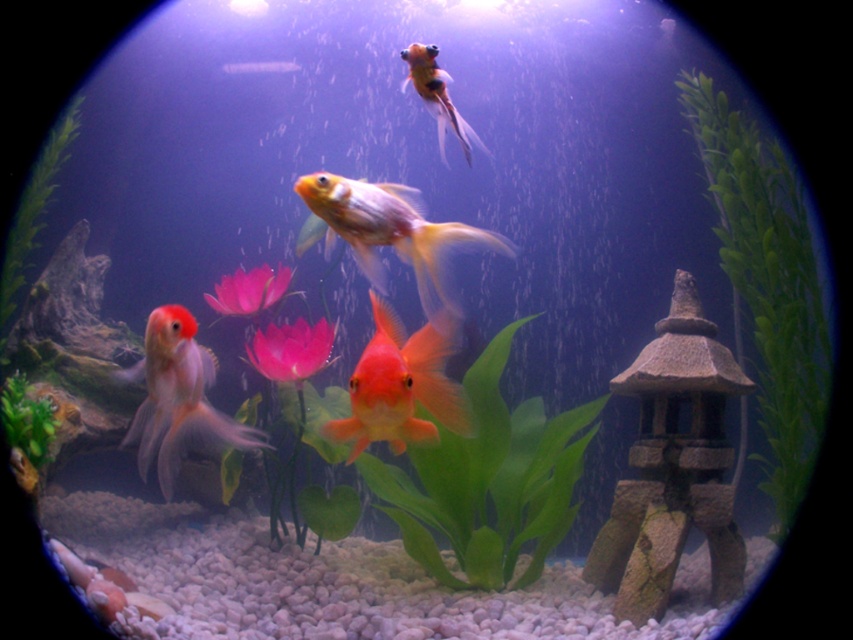
Question: Observing the image, what is the correct spatial positioning of pink matte flower at center in reference to green matte plant at lower left?

Choices:
 (A) below
 (B) above

Answer: (B)

Question: Does matte white goldfish at lower left appear under green matte plant at lower left?

Choices:
 (A) yes
 (B) no

Answer: (B)

Question: Which point appears farthest from the camera in this image?

Choices:
 (A) (270, 300)
 (B) (463, 390)
 (C) (19, 253)

Answer: (C)

Question: Which point is farther to the camera?

Choices:
 (A) green matte plant at lower left
 (B) green leafy plant at center
 (C) green leafy plant at left
 (D) shiny orange fish at upper center

Answer: (C)

Question: Among these objects, which one is farthest from the camera?

Choices:
 (A) pink matte flower at center
 (B) glossy orange goldfish at center
 (C) green leafy plant at left

Answer: (C)

Question: Is green leafy plant at right to the left of glossy orange goldfish at center from the viewer's perspective?

Choices:
 (A) yes
 (B) no

Answer: (B)